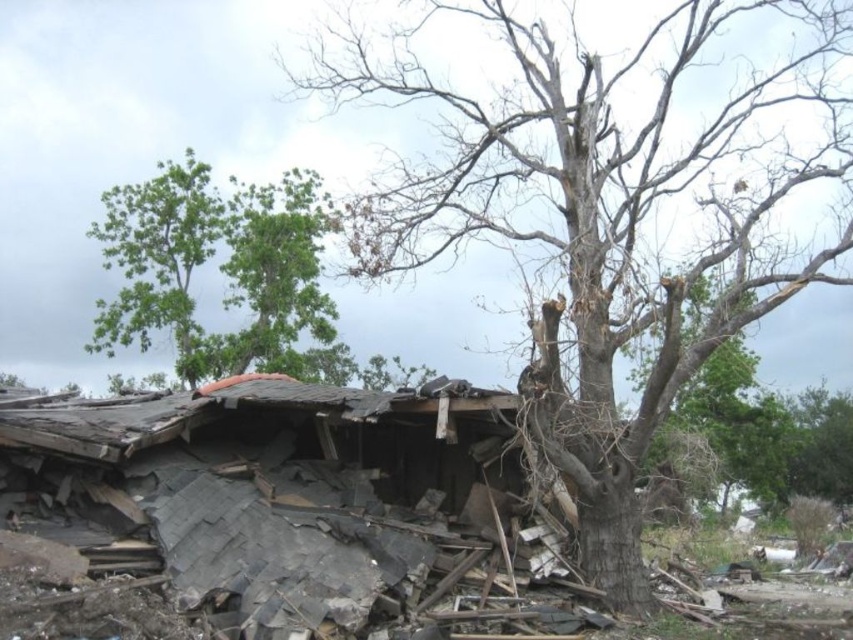
You are a rescue worker trying to locate the bare wood tree at center in the image. According to the coordinates provided, where would you look to find it?

The bare wood tree at center is located at point (601, 221).

You are a rescue worker assessing the area after a storm. You notice the bare wood tree at center and the green leafy tree at upper left. Which tree is closer to you?

The bare wood tree at center is closer to you because it is in front of the green leafy tree at upper left.

You are a rescue worker assessing the damage in the area. There is a point marked at coordinates (601,221) in the image. What object does this point correspond to?

The point at coordinates (601,221) corresponds to the bare wood tree at center.